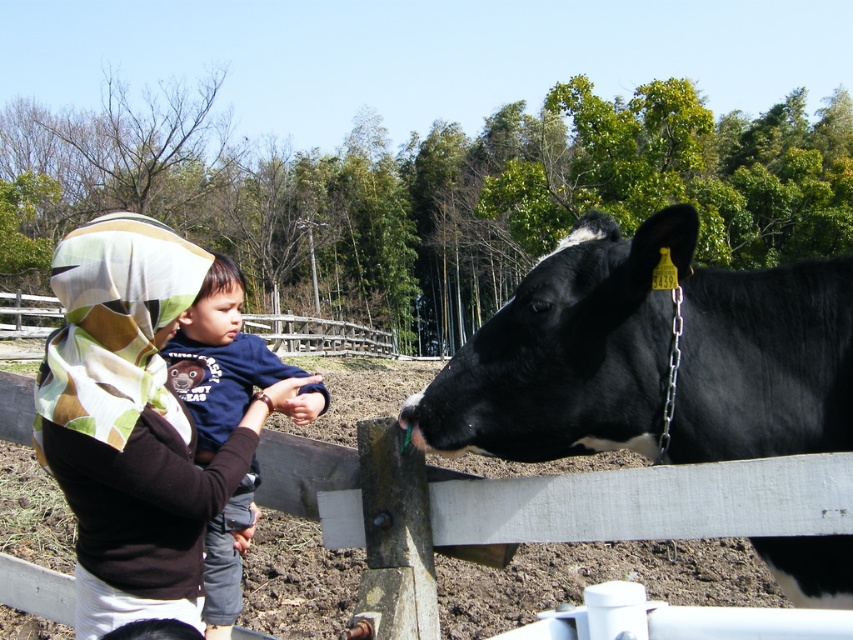
Question: Does black glossy cow at right have a lesser width compared to brown textured scarf at upper left?

Choices:
 (A) no
 (B) yes

Answer: (A)

Question: Which point appears farthest from the camera in this image?

Choices:
 (A) (218, 385)
 (B) (735, 301)

Answer: (A)

Question: Which is nearer to the black glossy cow at right?

Choices:
 (A) dark blue cotton shirt at center
 (B) brown textured scarf at upper left

Answer: (B)

Question: Can you confirm if black glossy cow at right is positioned above brown textured scarf at upper left?

Choices:
 (A) no
 (B) yes

Answer: (B)

Question: Which point is farther to the camera?

Choices:
 (A) (91, 592)
 (B) (514, 304)
 (C) (222, 296)

Answer: (C)

Question: Does black glossy cow at right appear over dark blue cotton shirt at center?

Choices:
 (A) yes
 (B) no

Answer: (A)